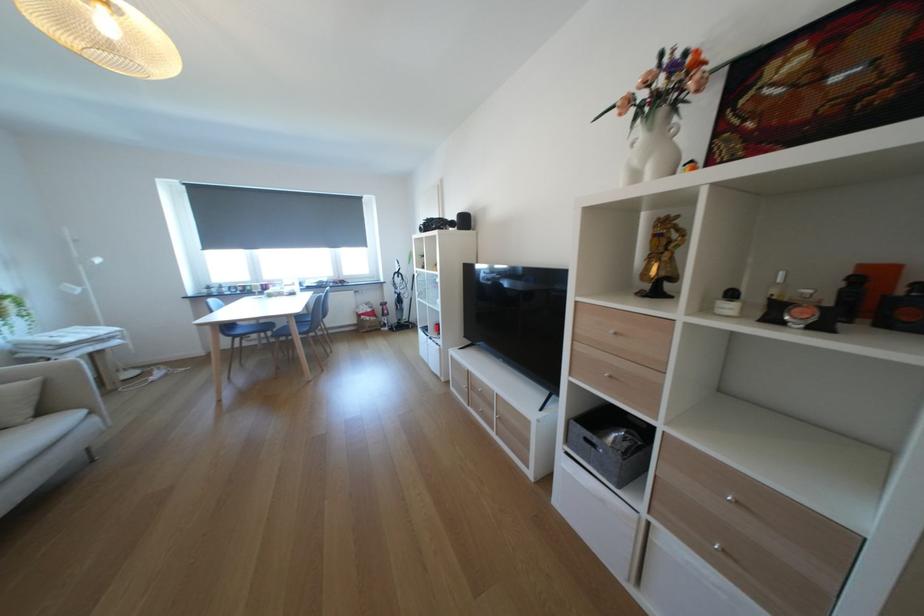
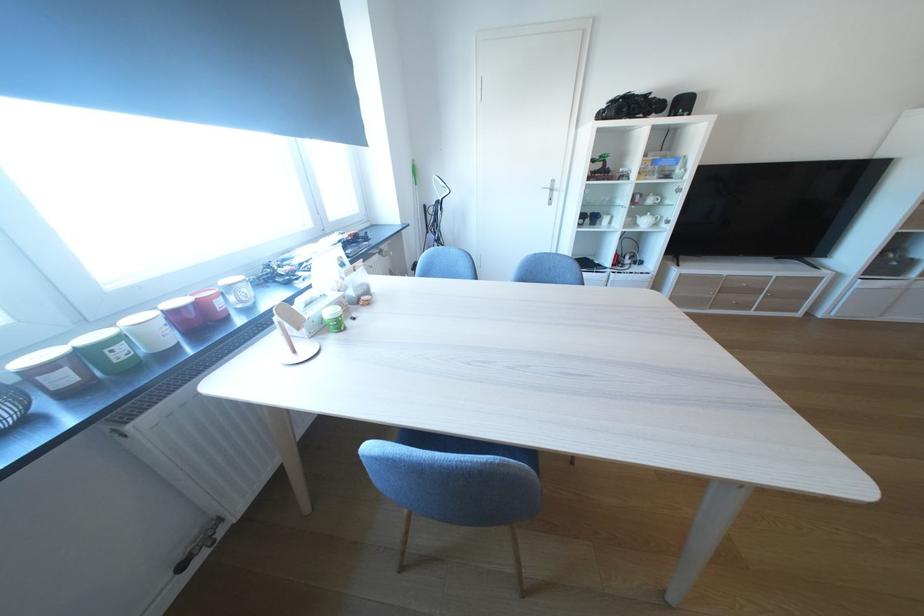
The point at [260,290] is marked in the first image. Where is the corresponding point in the second image?

(129, 354)